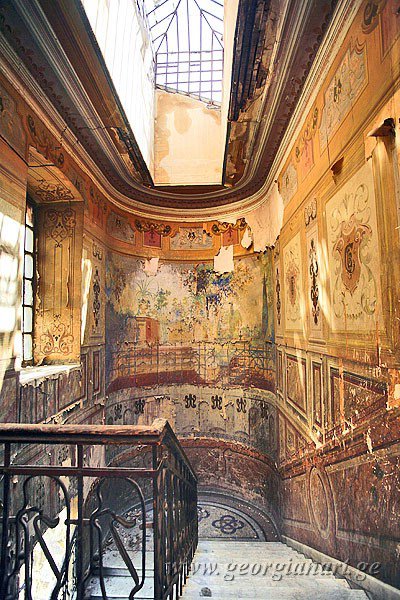
Image resolution: width=400 pixels, height=600 pixels. Find the location of `wall to the left of the stairs`. wall to the left of the stairs is located at coordinates [x=44, y=398].